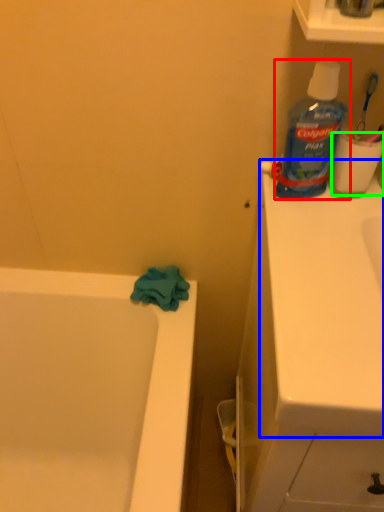
Question: Estimate the real-world distances between objects in this image. Which object is farther from bottle (highlighted by a red box), counter top (highlighted by a blue box) or toilet paper (highlighted by a green box)?

Choices:
 (A) counter top
 (B) toilet paper

Answer: (A)